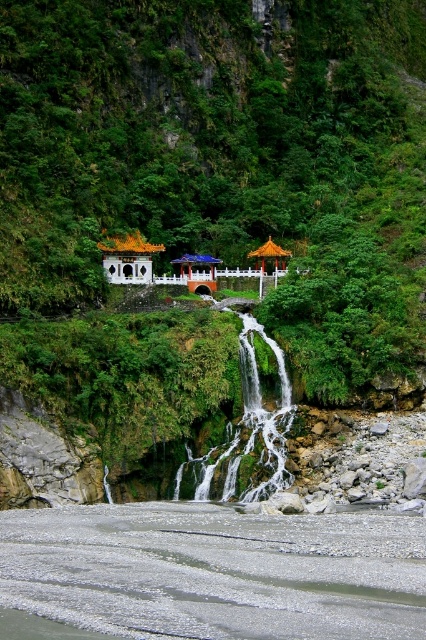
Question: Which object appears farthest from the camera in this image?

Choices:
 (A) green mossy waterfall at center
 (B) matte orange gazebo at center

Answer: (B)

Question: Is gray gravel river at lower center to the left of matte orange gazebo at center from the viewer's perspective?

Choices:
 (A) no
 (B) yes

Answer: (A)

Question: Does white glossy gazebo at left have a smaller size compared to matte orange gazebo at center?

Choices:
 (A) yes
 (B) no

Answer: (B)

Question: Among these objects, which one is farthest from the camera?

Choices:
 (A) green mossy waterfall at center
 (B) gray gravel river at lower center
 (C) white glossy gazebo at left
 (D) matte orange gazebo at center

Answer: (D)

Question: Considering the real-world distances, which object is closest to the matte orange gazebo at center?

Choices:
 (A) gray gravel river at lower center
 (B) green mossy waterfall at center
 (C) white glossy gazebo at left

Answer: (C)

Question: Can you confirm if gray gravel river at lower center is positioned to the left of white glossy gazebo at left?

Choices:
 (A) yes
 (B) no

Answer: (B)